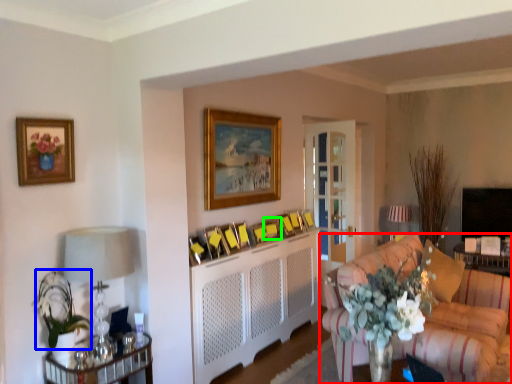
Question: Considering the real-world distances, which object is farthest from studio couch (highlighted by a red box)? floral arrangement (highlighted by a blue box) or picture frame (highlighted by a green box)?

Choices:
 (A) floral arrangement
 (B) picture frame

Answer: (A)